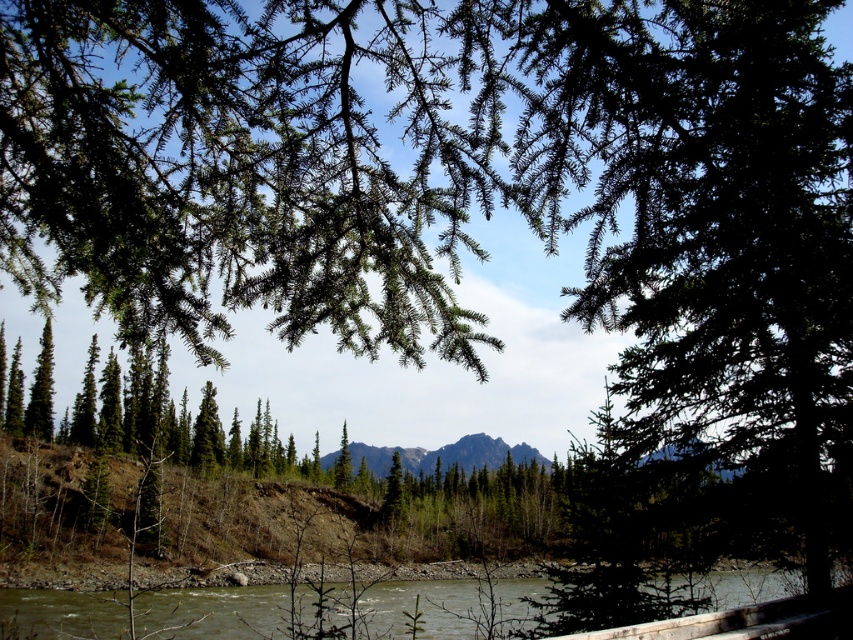
You are standing in the serene natural landscape scene. You see two points marked in the image. Which point, point (711,616) or point (341,483), is closer to you?

Point (711,616) is closer to the camera than point (341,483).

You are standing at the edge of the forest and want to cross the river. You have a 30 meter long rope. Do you think the rope will be sufficient to span the distance between the brown gravel river at lower center and the green matte evergreen tree at lower left?

The distance between the brown gravel river at lower center and the green matte evergreen tree at lower left is 31.14 meters. Since the rope is only 30 meters long, it will not be sufficient to span the distance.

Based on the photo, you are standing at the edge of the forest looking at the scene. You see the brown gravel river at lower center and the green matte evergreen tree at lower left. Which object is positioned lower in the image?

The brown gravel river at lower center is positioned below the green matte evergreen tree at lower left, so the river is lower in the image.